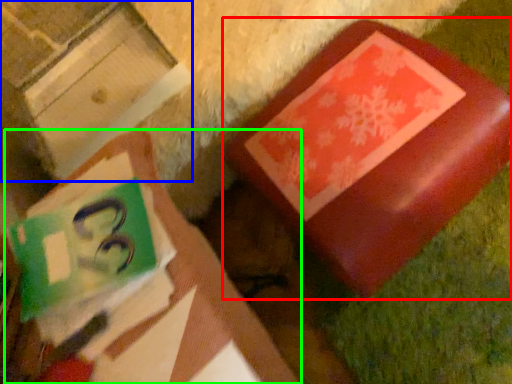
Question: Which is farther away from furniture (highlighted by a red box)? cardboard box (highlighted by a blue box) or book (highlighted by a green box)?

Choices:
 (A) cardboard box
 (B) book

Answer: (A)